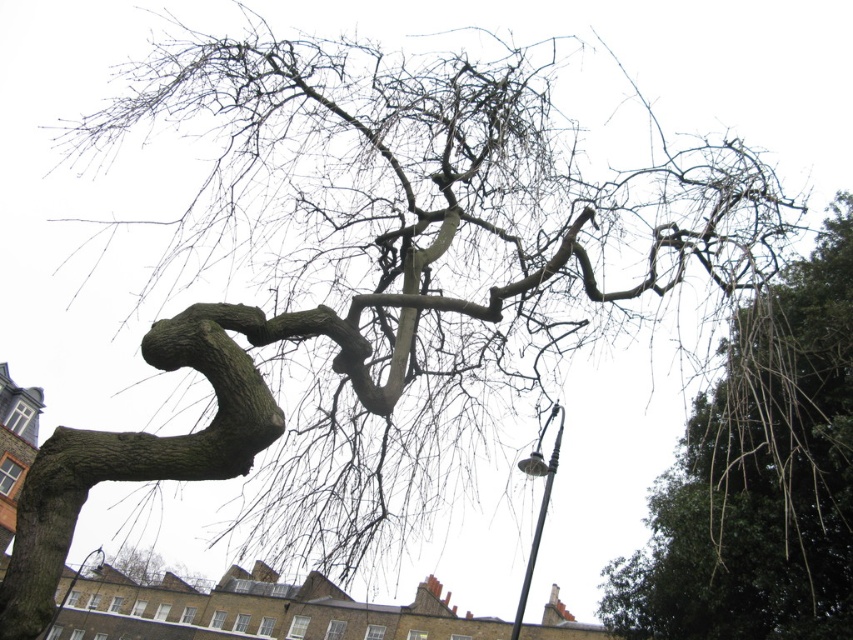
Who is positioned more to the right, black metal streetlight at lower right or metallic gray lamp post at lower left?

Positioned to the right is black metal streetlight at lower right.

Can you confirm if black metal streetlight at lower right is positioned to the right of metallic gray lamp post at lower left?

Correct, you'll find black metal streetlight at lower right to the right of metallic gray lamp post at lower left.

I want to click on black metal streetlight at lower right, so click(540, 502).

The width and height of the screenshot is (853, 640). Describe the element at coordinates (758, 476) in the screenshot. I see `bare branches at upper right` at that location.

Is bare branches at upper right further to camera compared to black metal streetlight at lower right?

No.

Is point (791, 556) positioned behind point (552, 451)?

That is True.

You are a GUI agent. You are given a task and a screenshot of the screen. Output one action in this format:
    pyautogui.click(x=<x>, y=<y>)
    Task: Click on the bare branches at upper right
    
    Given the screenshot: What is the action you would take?
    pyautogui.click(x=758, y=476)

Is bare branches at upper right wider than metallic gray lamp post at lower left?

Incorrect, bare branches at upper right's width does not surpass metallic gray lamp post at lower left's.

Which is behind, point (844, 548) or point (100, 564)?

Point (100, 564)

Identify the location of bare branches at upper right. (758, 476).